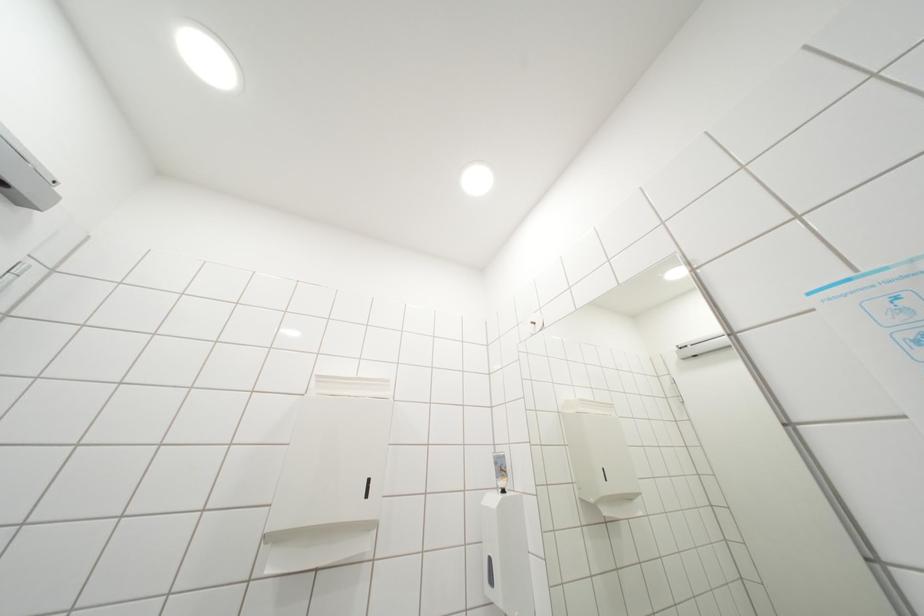
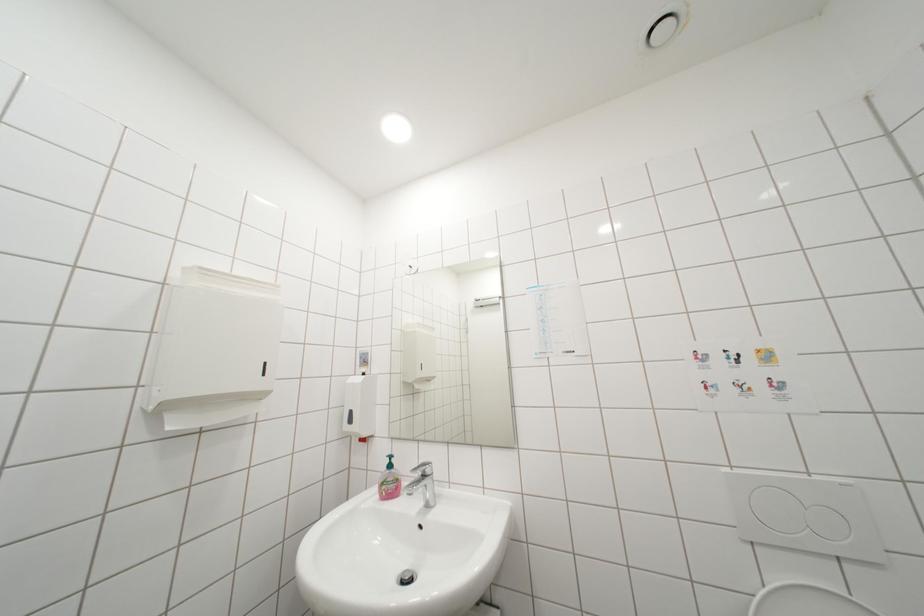
Question: How did the camera likely rotate?

Choices:
 (A) Left
 (B) Right
 (C) Up
 (D) Down

Answer: (B)